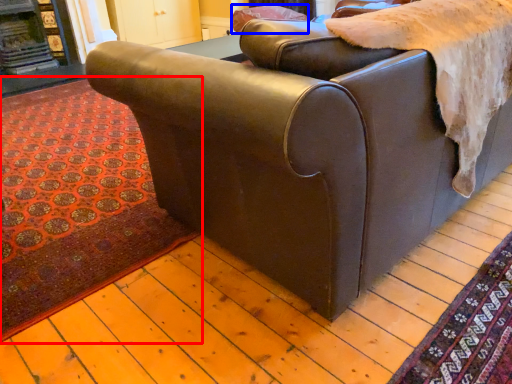
Question: Which point is closer to the camera, mat (highlighted by a red box) or pillow (highlighted by a blue box)?

Choices:
 (A) mat
 (B) pillow

Answer: (A)